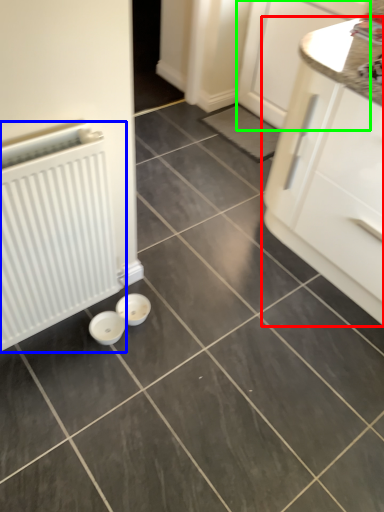
Question: Which object is the farthest from cabinetry (highlighted by a red box)? Choose among these: radiator (highlighted by a blue box) or cabinetry (highlighted by a green box).

Choices:
 (A) radiator
 (B) cabinetry

Answer: (A)